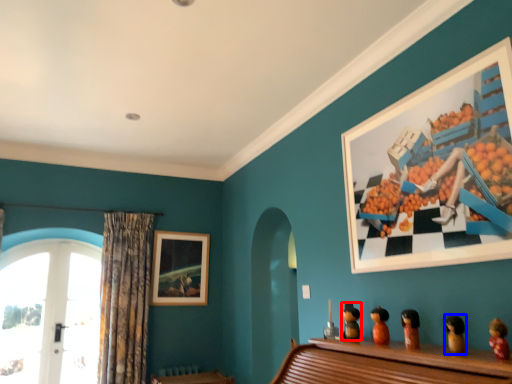
Question: Which point is further to the camera, toy (highlighted by a red box) or toy (highlighted by a blue box)?

Choices:
 (A) toy
 (B) toy

Answer: (A)